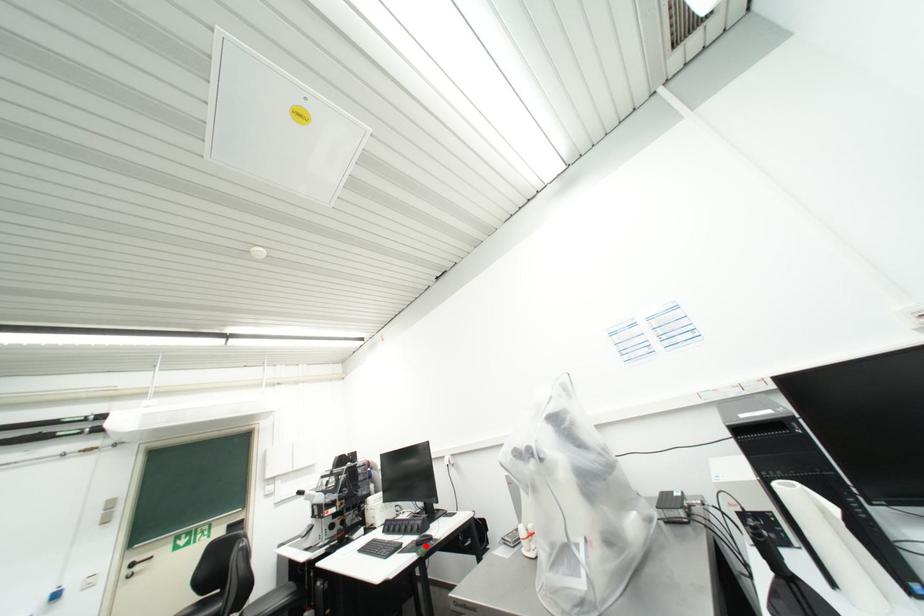
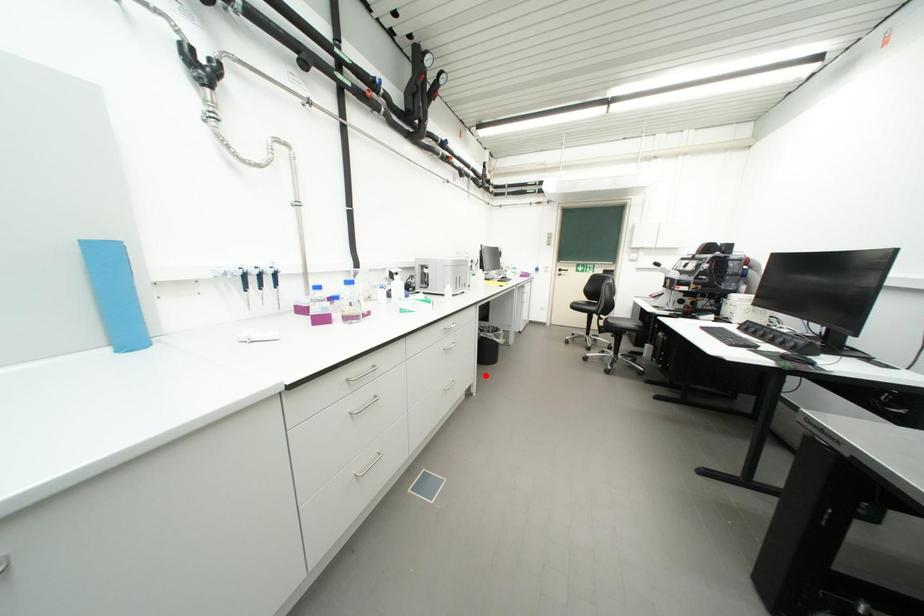
I am providing you with two images of the same scene from different viewpoints. A red point is marked on the first image and another point is marked on the second image. Is the red point in image1 aligned with the point shown in image2?

No